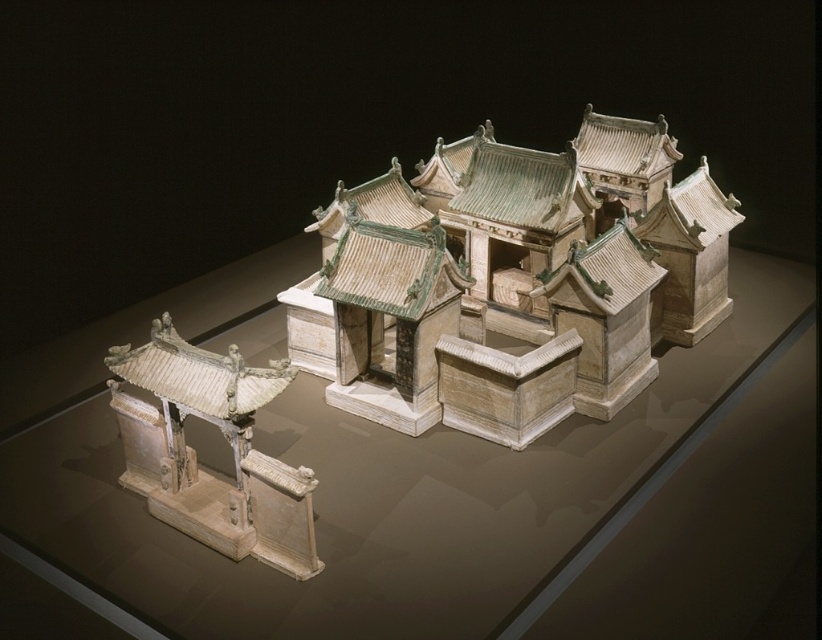
You are standing at the entrance of the miniature architectural model and see the white stone building at center and the white ceramic gate at lower left. Which object is higher in elevation?

The white stone building at center is higher in elevation than the white ceramic gate at lower left because it is positioned above it in the model.

You are a visitor at a historical exhibition and see the white stone building at center and the white ceramic gate at lower left in the miniature model. Which structure would you need to look up at more to see clearly?

The white stone building at center is taller than the white ceramic gate at lower left, so you would need to look up more to see the white stone building at center clearly.

From the picture: You are arranging a display in a museum and need to place a 30cm tall figurine on either the transparent glass table at center or the white ceramic gate at lower left. Which surface can accommodate the figurine without it exceeding the edge?

The transparent glass table at center has a larger size compared to the white ceramic gate at lower left, so the figurine can be placed on the transparent glass table at center without exceeding the edges.